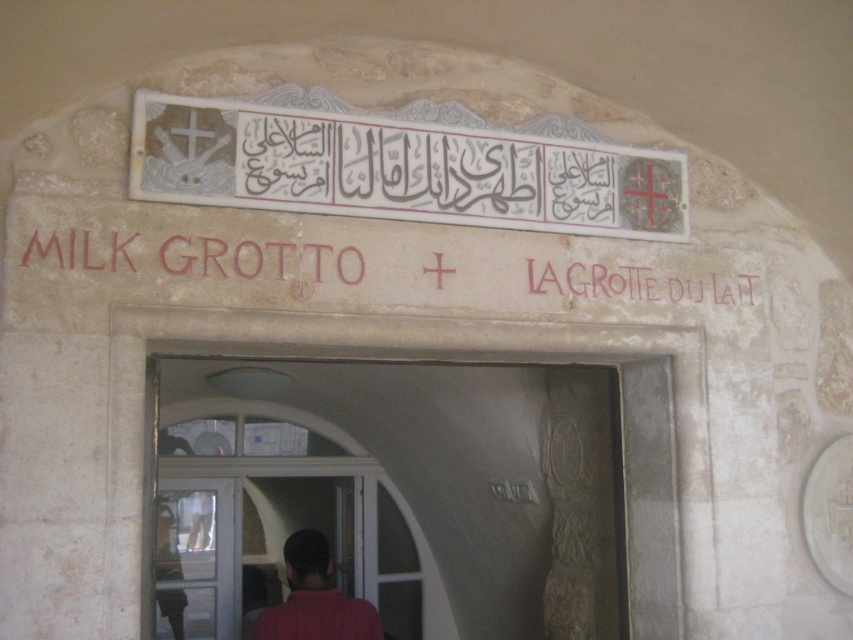
Question: Does red stone sign at center have a lesser width compared to transparent glass door at lower left?

Choices:
 (A) no
 (B) yes

Answer: (A)

Question: Does red stone sign at center appear under transparent glass door at lower left?

Choices:
 (A) no
 (B) yes

Answer: (A)

Question: Which object is the farthest from the transparent glass door at lower left?

Choices:
 (A) red stone sign at center
 (B) white stone signboard at upper center

Answer: (B)

Question: Among these objects, which one is farthest from the camera?

Choices:
 (A) white stone signboard at upper center
 (B) red matte shirt at center

Answer: (B)

Question: Which of the following is the closest to the observer?

Choices:
 (A) 181,266
 (B) 328,563
 (C) 183,192

Answer: (A)

Question: In this image, where is red stone sign at center located relative to transparent glass door at lower left?

Choices:
 (A) above
 (B) below

Answer: (A)